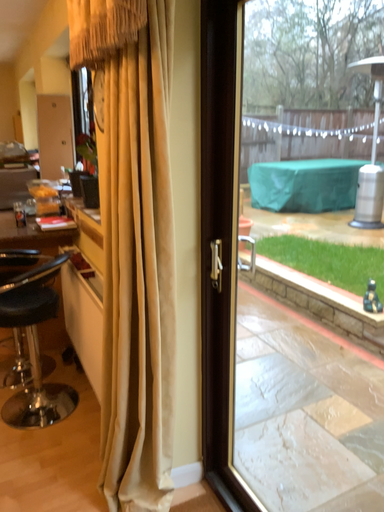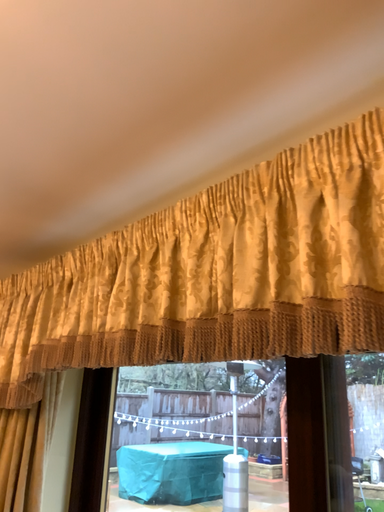
Question: Which way did the camera rotate in the video?

Choices:
 (A) rotated right
 (B) rotated left

Answer: (A)